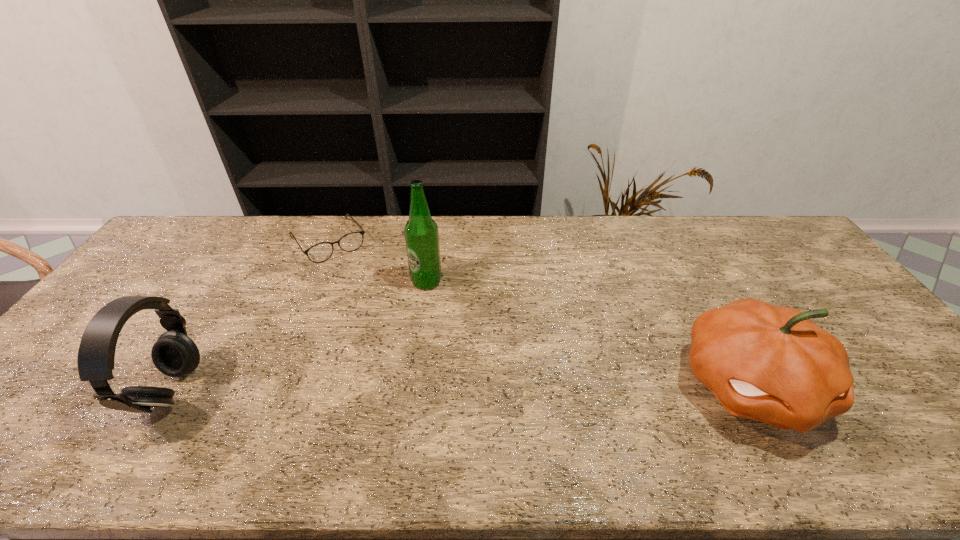
Locate an element on the screen. The image size is (960, 540). vacant region located 0.380m on the label of the tallest object is located at coordinates (391, 401).

The height and width of the screenshot is (540, 960). I want to click on vacant space located on the label of the tallest object, so click(x=417, y=313).

I want to click on blank space located 0.350m on the label of the tallest object, so click(x=394, y=390).

Where is `object situated at the far edge`? Image resolution: width=960 pixels, height=540 pixels. object situated at the far edge is located at coordinates point(320,252).

Where is `earphone that is positioned at the near edge`? The width and height of the screenshot is (960, 540). earphone that is positioned at the near edge is located at coordinates (174, 354).

The width and height of the screenshot is (960, 540). I want to click on pumpkin that is at the near edge, so click(x=773, y=364).

Where is `blank space at the far edge of the desktop`? The height and width of the screenshot is (540, 960). blank space at the far edge of the desktop is located at coordinates coord(315,224).

Where is `vacant space at the near edge of the desktop`? This screenshot has width=960, height=540. vacant space at the near edge of the desktop is located at coordinates (241, 401).

Identify the location of free region at the right edge of the desktop. This screenshot has height=540, width=960. (900, 383).

The width and height of the screenshot is (960, 540). I want to click on free location at the far right corner, so click(744, 236).